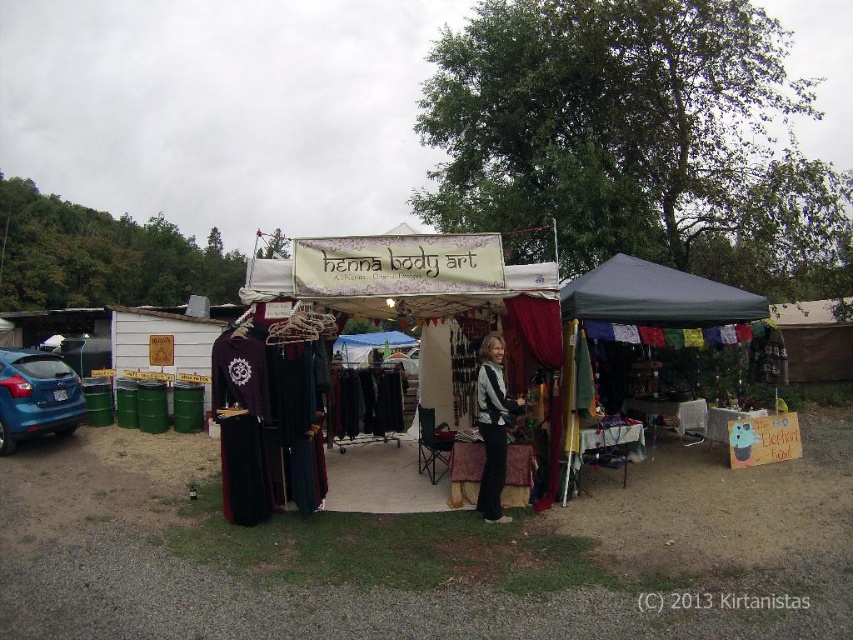
You are a customer at the outdoor market and want to buy a piece of fabric. You see the textured fabric stall at center and the dark gray fabric canopy at center. Which one is located below the other?

The textured fabric stall at center is positioned under the dark gray fabric canopy at center, so the stall is below the canopy.

You are a customer at the market and want to take a photo of the textured fabric stall at center and the blue matte car at left. Since you want both objects in the frame, which one should you position closer to the camera to ensure both are fully visible?

Since the textured fabric stall at center is taller than the blue matte car at left, you should position the blue matte car at left closer to the camera to ensure both objects are fully visible in the photo.